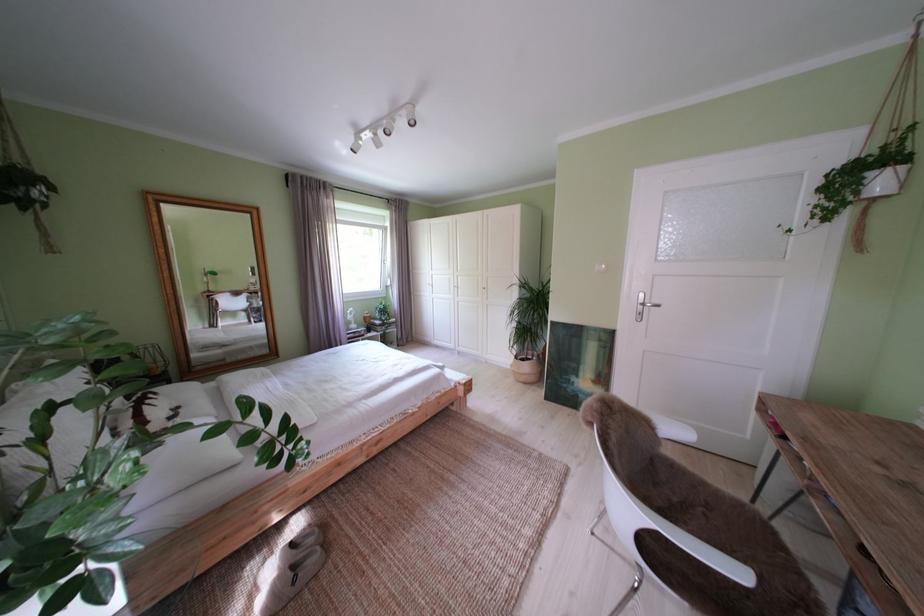
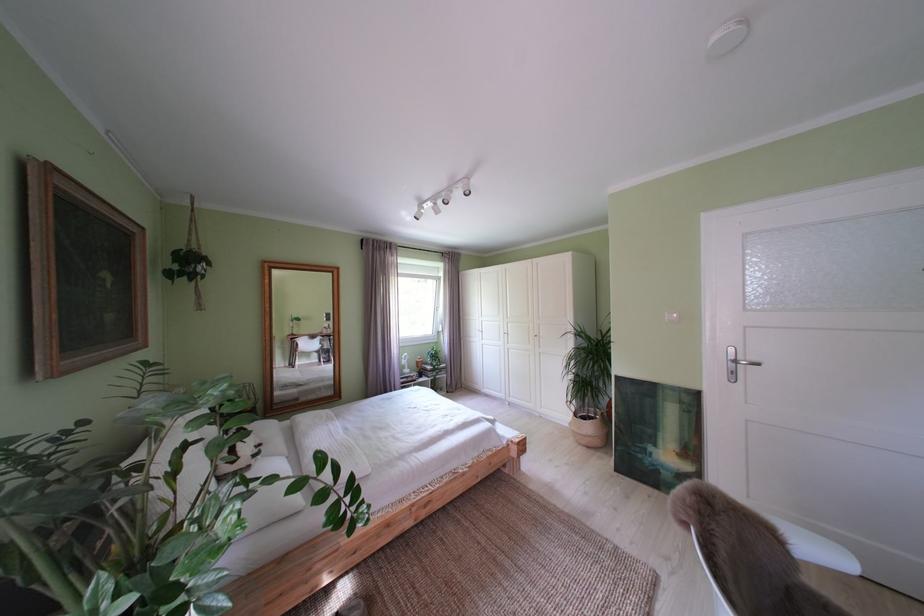
Question: I am providing you with two images of the same scene from different viewpoints. Which of the following objects are not visible in image2?

Choices:
 (A) white pillow
 (B) woven basket pot
 (C) white wardrobe handle
 (D) none of these

Answer: (D)